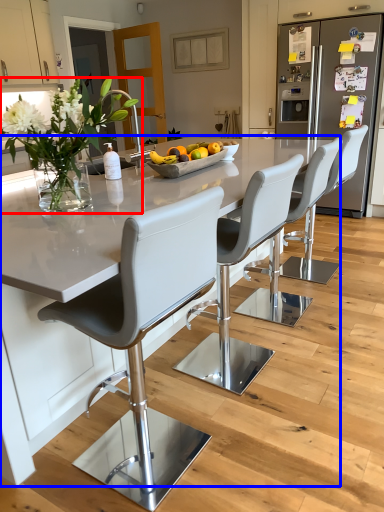
Question: Which of the following is the farthest to the observer, floral arrangement (highlighted by a red box) or kitchen & dining room table (highlighted by a blue box)?

Choices:
 (A) floral arrangement
 (B) kitchen & dining room table

Answer: (A)